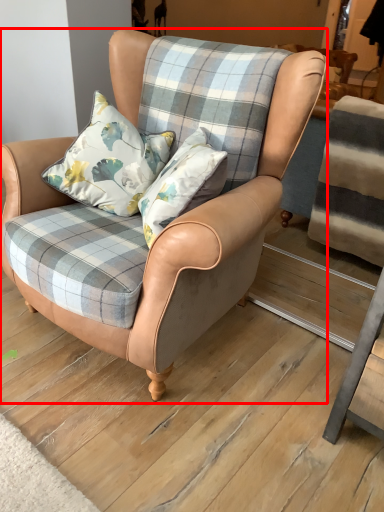
Question: From the image's perspective, where is chair (annotated by the red box) located relative to pillow?

Choices:
 (A) below
 (B) above

Answer: (A)